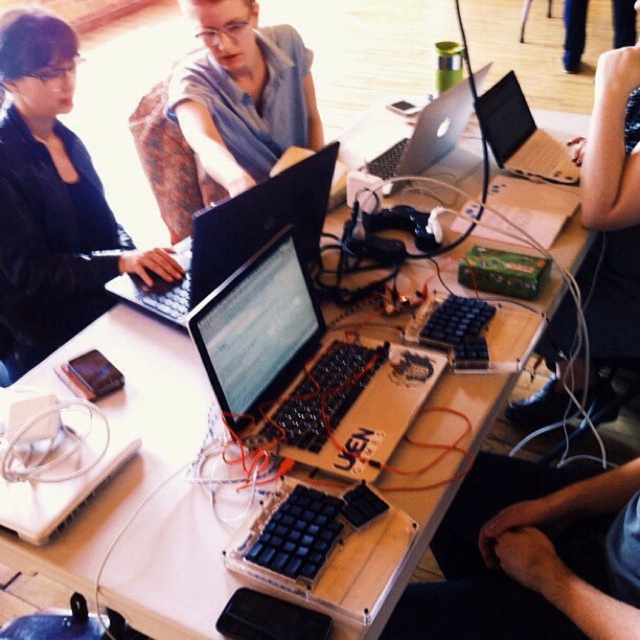
Question: Estimate the real-world distances between objects in this image. Which object is closer to the satin silver laptop at center?

Choices:
 (A) black fabric sleeve at upper right
 (B) black plastic laptop at center
 (C) translucent plastic laptop at center
 (D) matte black laptop at left

Answer: (A)

Question: Does matte blue shirt at center have a smaller size compared to satin silver laptop at center?

Choices:
 (A) no
 (B) yes

Answer: (A)

Question: Which object appears closest to the camera in this image?

Choices:
 (A) black fabric sleeve at upper right
 (B) translucent plastic laptop at center

Answer: (B)

Question: Can you confirm if black matte keyboard at lower right is positioned to the left of matte blue shirt at center?

Choices:
 (A) no
 (B) yes

Answer: (A)

Question: Is translucent plastic laptop at center positioned at the back of satin silver laptop at center?

Choices:
 (A) yes
 (B) no

Answer: (B)

Question: Which point is farther from the camera taking this photo?

Choices:
 (A) (93, 292)
 (B) (291, 122)

Answer: (B)